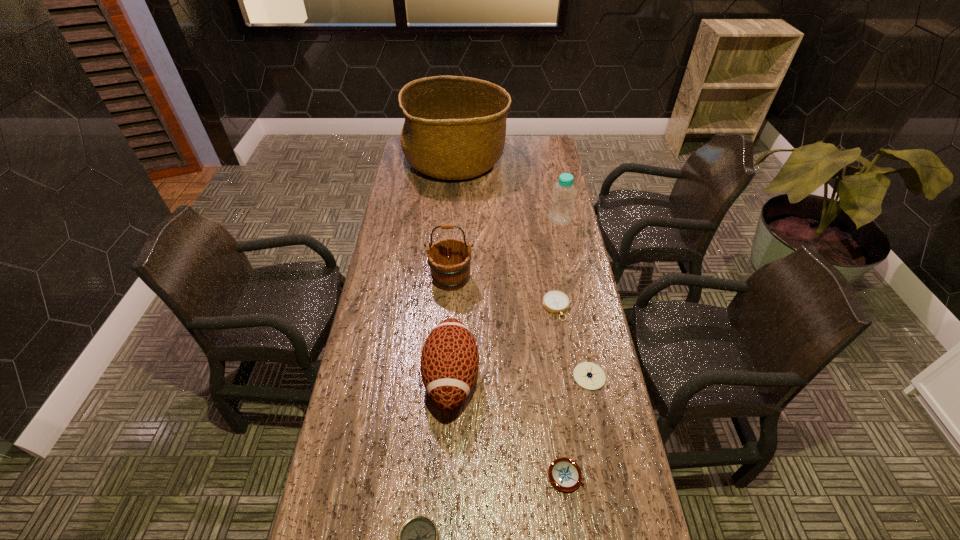
I want to click on the second nearest object, so click(x=564, y=473).

Locate an element on the screen. This screenshot has height=540, width=960. free space located 0.390m on the front of the tallest object is located at coordinates (449, 249).

The image size is (960, 540). In order to click on vacant point located 0.270m on the back of the wine bucket in this screenshot , I will do `click(455, 217)`.

Find the location of a particular element. vacant space located on the left of the bottle is located at coordinates (508, 220).

Identify the location of free space located on the left of the fifth shortest object. (382, 377).

Locate an element on the screen. vacant space situated on the left of the fourth shortest object is located at coordinates (494, 376).

Where is `free space located 0.350m on the front of the farthest compass`? free space located 0.350m on the front of the farthest compass is located at coordinates (574, 424).

I want to click on vacant region located 0.150m on the back of the third farthest compass, so click(557, 404).

What are the coordinates of `object located at the far edge` in the screenshot? It's located at (455, 127).

The image size is (960, 540). I want to click on object present at the left edge, so click(x=455, y=127).